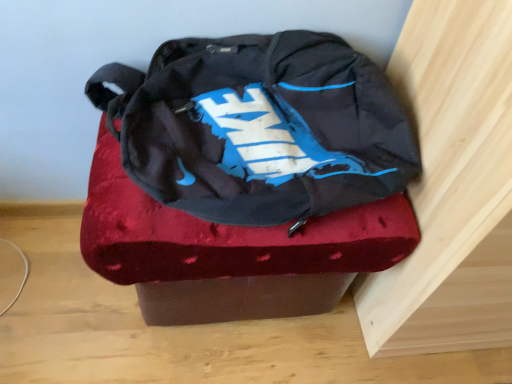
In order to face velvet-like red ottoman at center, should I rotate leftwards or rightwards?

You should look left and rotate roughly 0.624 degrees.

The width and height of the screenshot is (512, 384). Describe the element at coordinates (230, 252) in the screenshot. I see `velvet-like red ottoman at center` at that location.

Identify the location of velvet-like red ottoman at center. The image size is (512, 384). (230, 252).

The height and width of the screenshot is (384, 512). Identify the location of matte black backpack at center. (259, 127).

Measure the distance between point (316, 86) and camera.

The depth of point (316, 86) is 26.81 inches.

What do you see at coordinates (259, 127) in the screenshot? I see `matte black backpack at center` at bounding box center [259, 127].

At what (x,y) coordinates should I click in order to perform the action: click on velvet-like red ottoman at center. Please return your answer as a coordinate pair (x, y). Looking at the image, I should click on (230, 252).

Which is more to the left, matte black backpack at center or velvet-like red ottoman at center?

From the viewer's perspective, velvet-like red ottoman at center appears more on the left side.

Is matte black backpack at center in front of velvet-like red ottoman at center?

Yes, matte black backpack at center is in front of velvet-like red ottoman at center.

Is point (142, 136) positioned before point (163, 220)?

No, (142, 136) is behind (163, 220).

From the image's perspective, is matte black backpack at center above or below velvet-like red ottoman at center?

Based on their image positions, matte black backpack at center is located above velvet-like red ottoman at center.

From a real-world perspective, between matte black backpack at center and velvet-like red ottoman at center, who is vertically lower?

velvet-like red ottoman at center, from a real-world perspective.

Looking at this image, considering the relative sizes of matte black backpack at center and velvet-like red ottoman at center in the image provided, is matte black backpack at center thinner than velvet-like red ottoman at center?

Correct, the width of matte black backpack at center is less than that of velvet-like red ottoman at center.

Can you confirm if matte black backpack at center is shorter than velvet-like red ottoman at center?

No, matte black backpack at center is not shorter than velvet-like red ottoman at center.

Is matte black backpack at center bigger or smaller than velvet-like red ottoman at center?

Clearly, matte black backpack at center is larger in size than velvet-like red ottoman at center.

Is matte black backpack at center located outside velvet-like red ottoman at center?

Indeed, matte black backpack at center is completely outside velvet-like red ottoman at center.

Is the surface of matte black backpack at center in direct contact with velvet-like red ottoman at center?

matte black backpack at center and velvet-like red ottoman at center are not in contact.

Is matte black backpack at center facing towards velvet-like red ottoman at center?

No, matte black backpack at center is not aimed at velvet-like red ottoman at center.

At what (x,y) coordinates should I click in order to perform the action: click on backpack that is above the velvet-like red ottoman at center (from the image's perspective). Please return your answer as a coordinate pair (x, y). The image size is (512, 384). Looking at the image, I should click on (259, 127).

Based on their positions, is velvet-like red ottoman at center located to the left or right of matte black backpack at center?

velvet-like red ottoman at center is positioned on matte black backpack at center's left side.

Is the position of velvet-like red ottoman at center less distant than that of matte black backpack at center?

That is False.

Is point (343, 217) in front of point (263, 172)?

No, it is not.

From the image's perspective, would you say velvet-like red ottoman at center is shown under matte black backpack at center?

Yes, from the image's perspective, velvet-like red ottoman at center is below matte black backpack at center.

From a real-world perspective, which is physically below, velvet-like red ottoman at center or matte black backpack at center?

velvet-like red ottoman at center is physically lower.

Does velvet-like red ottoman at center have a lesser width compared to matte black backpack at center?

Incorrect, the width of velvet-like red ottoman at center is not less than that of matte black backpack at center.

Which of these two, velvet-like red ottoman at center or matte black backpack at center, stands shorter?

Standing shorter between the two is velvet-like red ottoman at center.

Is velvet-like red ottoman at center smaller than matte black backpack at center?

Yes, velvet-like red ottoman at center is smaller than matte black backpack at center.

Choose the correct answer: Is velvet-like red ottoman at center inside matte black backpack at center or outside it?

velvet-like red ottoman at center is spatially situated outside matte black backpack at center.

Would you say velvet-like red ottoman at center is a long distance from matte black backpack at center?

That's not correct — velvet-like red ottoman at center is a little close to matte black backpack at center.

Is velvet-like red ottoman at center oriented away from matte black backpack at center?

No, matte black backpack at center is not at the back of velvet-like red ottoman at center.

How different are the orientations of velvet-like red ottoman at center and matte black backpack at center in degrees?

There is a 0.0656-degree angle between the facing directions of velvet-like red ottoman at center and matte black backpack at center.

Locate an element on the screen. The height and width of the screenshot is (384, 512). furniture below the matte black backpack at center (from the image's perspective) is located at coordinates (230, 252).

I want to click on furniture to the left of matte black backpack at center, so click(x=230, y=252).

Find the location of a particular element. The height and width of the screenshot is (384, 512). backpack that appears on the right of velvet-like red ottoman at center is located at coordinates (259, 127).